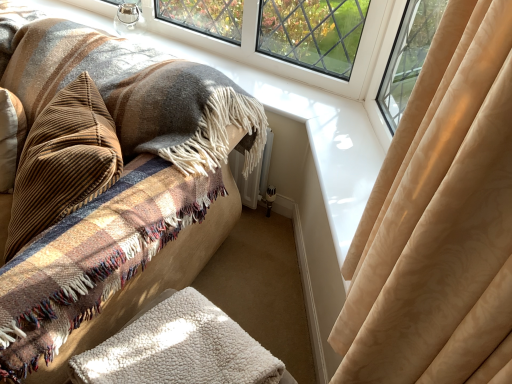
Question: Is brown corduroy pillow at left outside of plush beige rug at lower center?

Choices:
 (A) no
 (B) yes

Answer: (A)

Question: Can you confirm if brown corduroy pillow at left is shorter than plush beige rug at lower center?

Choices:
 (A) yes
 (B) no

Answer: (A)

Question: Is brown corduroy pillow at left aimed at plush beige rug at lower center?

Choices:
 (A) yes
 (B) no

Answer: (A)

Question: Does brown corduroy pillow at left have a larger size compared to plush beige rug at lower center?

Choices:
 (A) no
 (B) yes

Answer: (A)

Question: From the image's perspective, is brown corduroy pillow at left located beneath plush beige rug at lower center?

Choices:
 (A) yes
 (B) no

Answer: (A)

Question: Does point (5, 84) appear closer or farther from the camera than point (236, 379)?

Choices:
 (A) closer
 (B) farther

Answer: (B)

Question: Based on their sizes in the image, would you say plush beige rug at lower center is bigger or smaller than white fluffy blanket at lower center?

Choices:
 (A) big
 (B) small

Answer: (A)

Question: Is plush beige rug at lower center wider or thinner than white fluffy blanket at lower center?

Choices:
 (A) thin
 (B) wide

Answer: (B)

Question: From a real-world perspective, is plush beige rug at lower center physically located above or below white fluffy blanket at lower center?

Choices:
 (A) above
 (B) below

Answer: (B)

Question: In terms of size, does white fluffy blanket at lower center appear bigger or smaller than plush beige rug at lower center?

Choices:
 (A) big
 (B) small

Answer: (B)

Question: Considering the positions of white fluffy blanket at lower center and plush beige rug at lower center in the image, is white fluffy blanket at lower center wider or thinner than plush beige rug at lower center?

Choices:
 (A) wide
 (B) thin

Answer: (B)

Question: From the image's perspective, is white fluffy blanket at lower center located above or below plush beige rug at lower center?

Choices:
 (A) above
 (B) below

Answer: (B)

Question: From a real-world perspective, relative to plush beige rug at lower center, is white fluffy blanket at lower center vertically above or below?

Choices:
 (A) above
 (B) below

Answer: (A)

Question: Based on their positions, is white fluffy blanket at lower center located to the left or right of brown corduroy pillow at left?

Choices:
 (A) right
 (B) left

Answer: (A)

Question: Is white fluffy blanket at lower center inside or outside of brown corduroy pillow at left?

Choices:
 (A) inside
 (B) outside

Answer: (B)